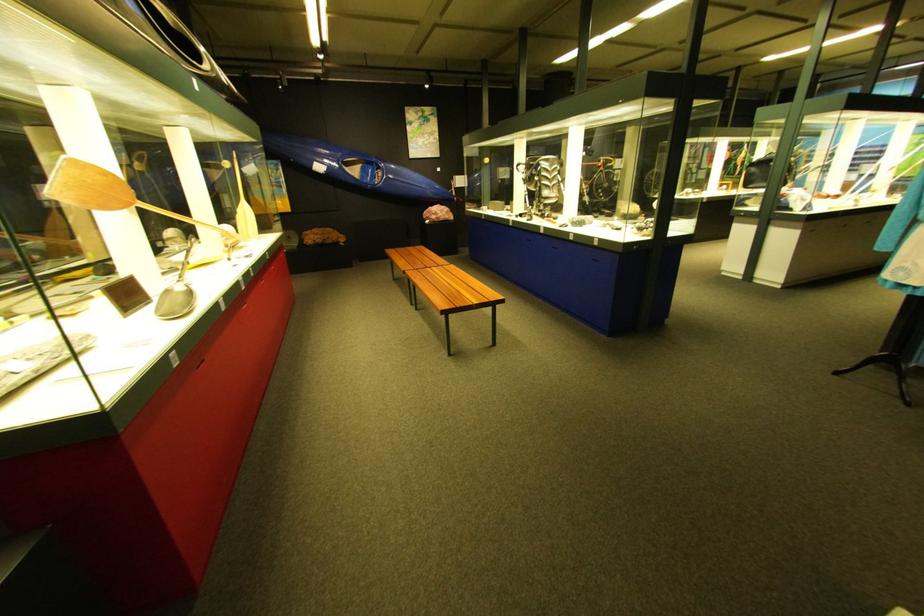
Describe the element at coordinates (443, 286) in the screenshot. This screenshot has height=616, width=924. I see `the wooden bench surface` at that location.